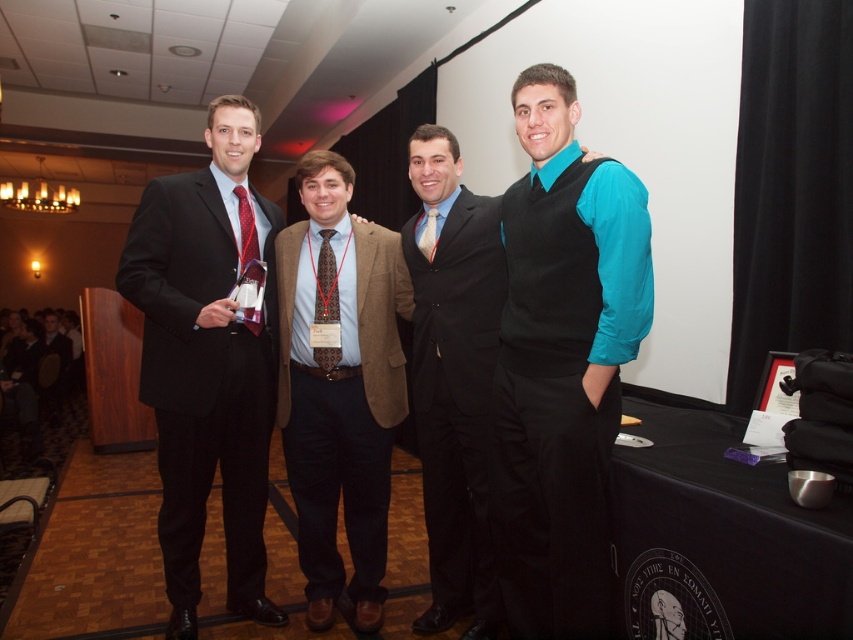
Consider the image. You are at a formal event where two points are marked in the scene. The first point is at coordinates point (428, 337) and the second point is at point (461, 524). Which of these two points is closer to you from your current viewing position?

Point (428, 337) is in front of point (461, 524), so it is closer to you.

You are a photographer at the event and need to capture a photo where both the brown wool blazer at center and the shiny red tie at center are visible. Based on their positions, which one should you focus on first to ensure both are in frame?

The brown wool blazer at center is below shiny red tie at center, so you should focus on the shiny red tie at center first to ensure both are in frame.